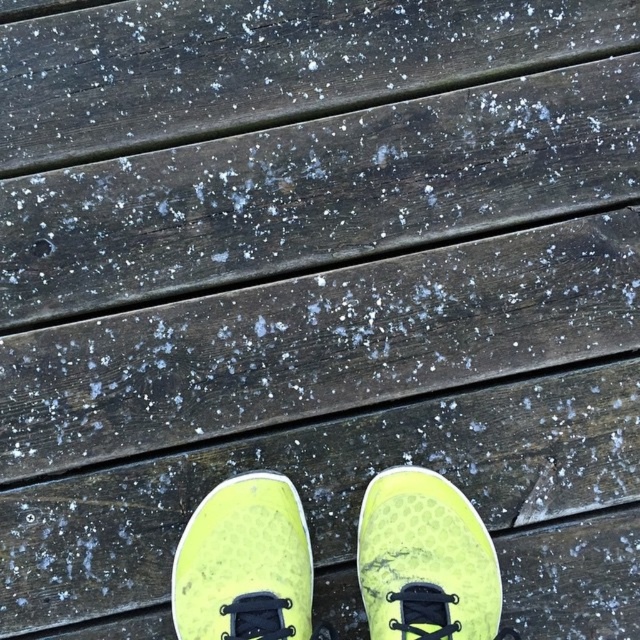
Is neon yellow fabric shoe at center bigger than neon yellow mesh shoe at center?

No, neon yellow fabric shoe at center is not bigger than neon yellow mesh shoe at center.

Is neon yellow fabric shoe at center in front of neon yellow mesh shoe at center?

That is False.

Where is `neon yellow fabric shoe at center`? The image size is (640, 640). neon yellow fabric shoe at center is located at coordinates (426, 561).